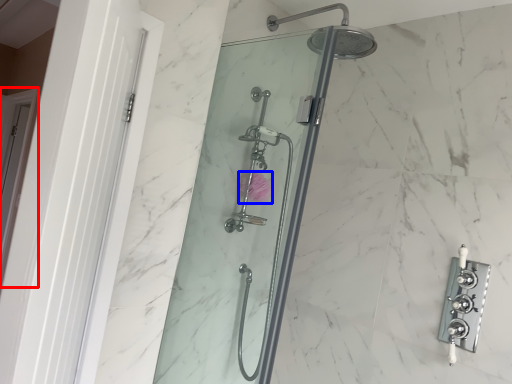
Question: Among these objects, which one is farthest to the camera, screen door (highlighted by a red box) or flower (highlighted by a blue box)?

Choices:
 (A) screen door
 (B) flower

Answer: (A)